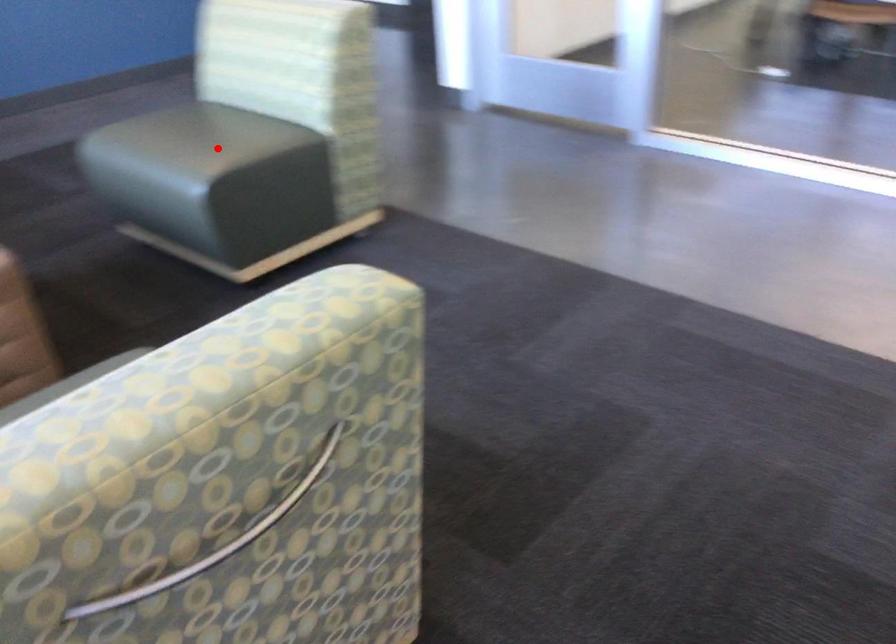
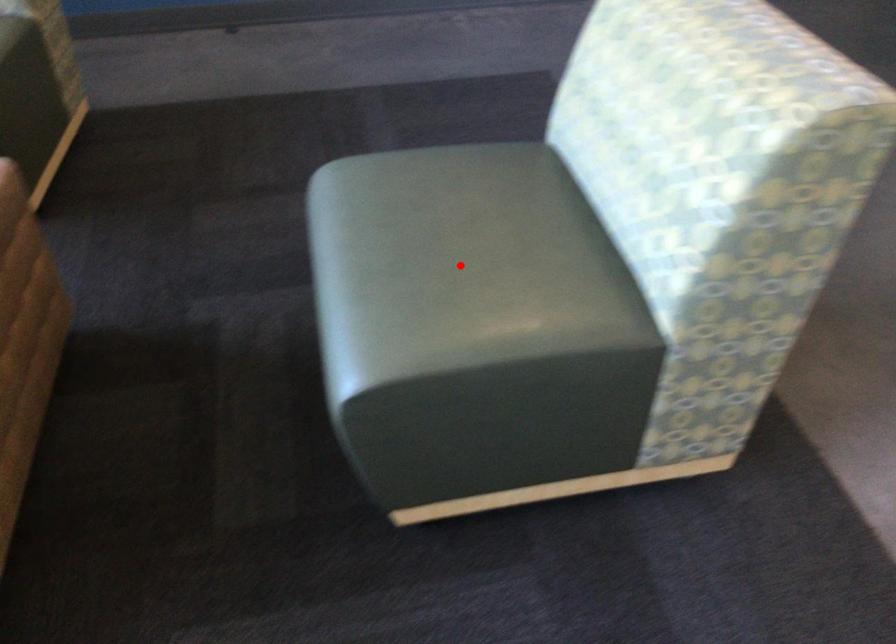
Looking at this image, I am providing you with two images of the same scene from different viewpoints. A red point is marked on the first image and another point is marked on the second image. Are the points marked in image1 and image2 representing the same 3D position?

Yes